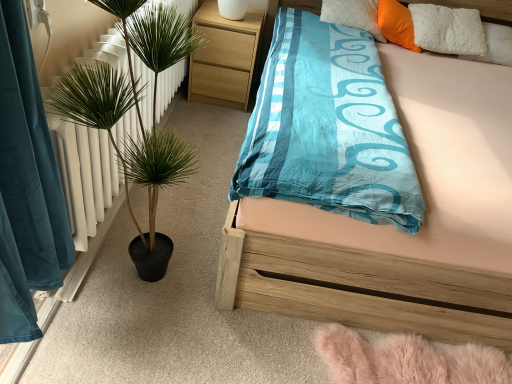
Question: Considering the positions of point (108, 200) and point (483, 304), is point (108, 200) closer or farther from the camera than point (483, 304)?

Choices:
 (A) closer
 (B) farther

Answer: (B)

Question: Is green leafy plant in pot at left situated inside wooden bed at center or outside?

Choices:
 (A) inside
 (B) outside

Answer: (B)

Question: Considering the real-world distances, which object is farthest from the wooden bed at center?

Choices:
 (A) light wood/texture nightstand at upper center
 (B) orange plush pillow at upper right
 (C) green leafy plant in pot at left

Answer: (A)

Question: Considering the real-world distances, which object is farthest from the light wood/texture nightstand at upper center?

Choices:
 (A) green leafy plant in pot at left
 (B) orange plush pillow at upper right
 (C) wooden bed at center

Answer: (C)